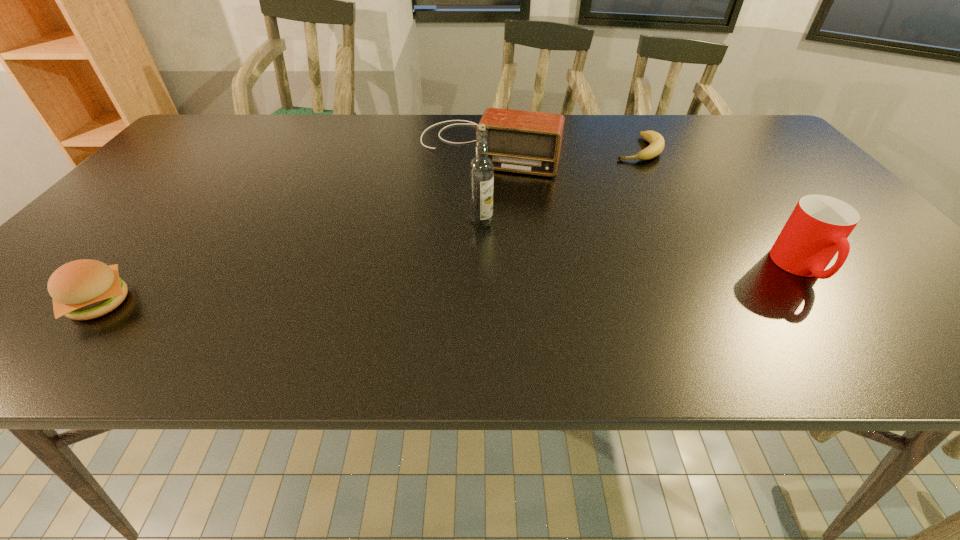
I want to click on the fourth tallest object, so click(x=85, y=289).

Locate an element on the screen. the leftmost object is located at coordinates (85, 289).

Identify the location of the rightmost object. (818, 228).

This screenshot has width=960, height=540. Identify the location of radio receiver. (527, 142).

This screenshot has width=960, height=540. In order to click on the second object from right to left in this screenshot , I will do `click(657, 143)`.

Identify the location of banana. Image resolution: width=960 pixels, height=540 pixels. (657, 143).

Image resolution: width=960 pixels, height=540 pixels. Find the location of `the third farthest object`. the third farthest object is located at coordinates (481, 169).

What are the coordinates of `the tallest object` in the screenshot? It's located at (481, 169).

Find the location of a particular element. The height and width of the screenshot is (540, 960). free space located on the back of the fourth tallest object is located at coordinates (186, 200).

Identify the location of vacant region located 0.110m on the front-facing side of the radio receiver. (461, 201).